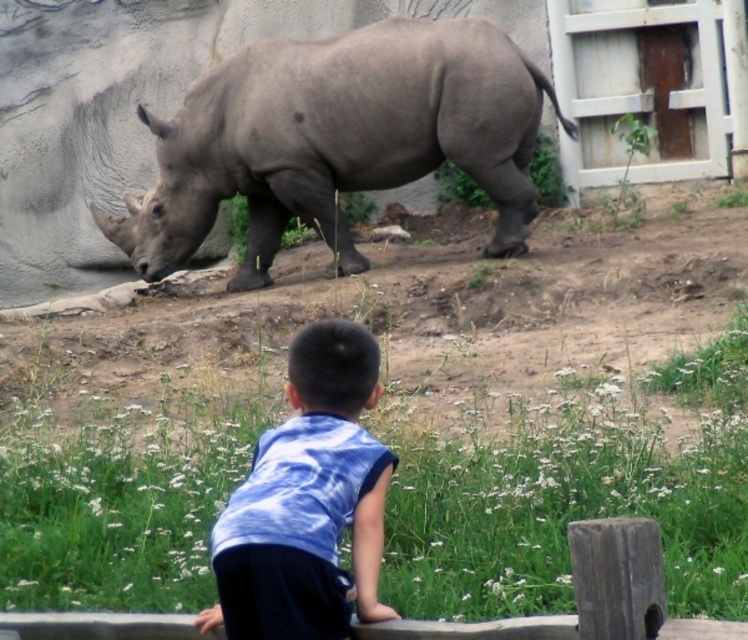
Question: Is gray matte rhinoceros at upper center behind blue tie-dye shirt at center?

Choices:
 (A) yes
 (B) no

Answer: (A)

Question: Does gray matte rhinoceros at upper center have a lesser width compared to blue tie-dye shirt at center?

Choices:
 (A) no
 (B) yes

Answer: (A)

Question: Can you confirm if gray matte rhinoceros at upper center is smaller than blue tie-dye shirt at center?

Choices:
 (A) no
 (B) yes

Answer: (A)

Question: Which point is closer to the camera taking this photo?

Choices:
 (A) pyautogui.click(x=300, y=592)
 (B) pyautogui.click(x=165, y=234)

Answer: (A)